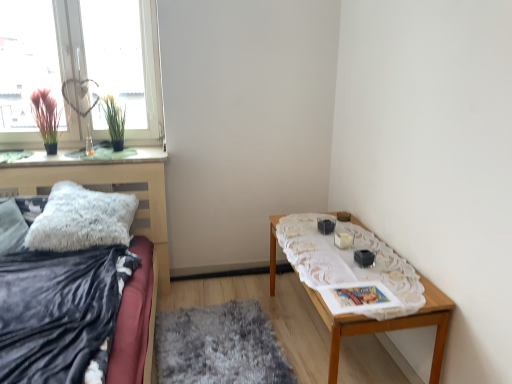
Question: Considering the relative sizes of silky pink plant at window, which is the 2th plant in right-to-left order, and transparent glass window at upper left in the image provided, is silky pink plant at window, which is the 2th plant in right-to-left order, smaller than transparent glass window at upper left?

Choices:
 (A) no
 (B) yes

Answer: (B)

Question: Can you confirm if silky pink plant at window, which is the 2th plant in right-to-left order, is wider than transparent glass window at upper left?

Choices:
 (A) yes
 (B) no

Answer: (A)

Question: From the image's perspective, is silky pink plant at window, arranged as the first plant when viewed from the left, located above transparent glass window at upper left?

Choices:
 (A) no
 (B) yes

Answer: (A)

Question: From the image's perspective, is silky pink plant at window, which is the 2th plant in right-to-left order, under transparent glass window at upper left?

Choices:
 (A) yes
 (B) no

Answer: (A)

Question: From a real-world perspective, is silky pink plant at window, which is the 2th plant in right-to-left order, over transparent glass window at upper left?

Choices:
 (A) yes
 (B) no

Answer: (B)

Question: Is silky pink plant at window, arranged as the first plant when viewed from the left, taller than transparent glass window at upper left?

Choices:
 (A) yes
 (B) no

Answer: (B)

Question: Considering the relative sizes of white lace tablecloth at right, the 1th blanket positioned from the right, and transparent glass window at upper left in the image provided, is white lace tablecloth at right, the 1th blanket positioned from the right, smaller than transparent glass window at upper left?

Choices:
 (A) yes
 (B) no

Answer: (A)

Question: Would you say transparent glass window at upper left is part of white lace tablecloth at right, the 2th blanket when ordered from left to right,'s contents?

Choices:
 (A) yes
 (B) no

Answer: (B)

Question: Considering the relative sizes of white lace tablecloth at right, the 1th blanket positioned from the right, and transparent glass window at upper left in the image provided, is white lace tablecloth at right, the 1th blanket positioned from the right, wider than transparent glass window at upper left?

Choices:
 (A) no
 (B) yes

Answer: (B)

Question: Is white lace tablecloth at right, the 1th blanket positioned from the right, in front of transparent glass window at upper left?

Choices:
 (A) yes
 (B) no

Answer: (A)

Question: Considering the relative sizes of white lace tablecloth at right, the 2th blanket when ordered from left to right, and transparent glass window at upper left in the image provided, is white lace tablecloth at right, the 2th blanket when ordered from left to right, thinner than transparent glass window at upper left?

Choices:
 (A) yes
 (B) no

Answer: (B)

Question: Is white lace tablecloth at right, the 2th blanket when ordered from left to right, oriented away from transparent glass window at upper left?

Choices:
 (A) yes
 (B) no

Answer: (B)

Question: Considering the relative sizes of silky pink plant at window, arranged as the first plant when viewed from the left, and green grass-like plant at upper left, positioned as the 1th plant in right-to-left order, in the image provided, is silky pink plant at window, arranged as the first plant when viewed from the left, shorter than green grass-like plant at upper left, positioned as the 1th plant in right-to-left order,?

Choices:
 (A) yes
 (B) no

Answer: (B)